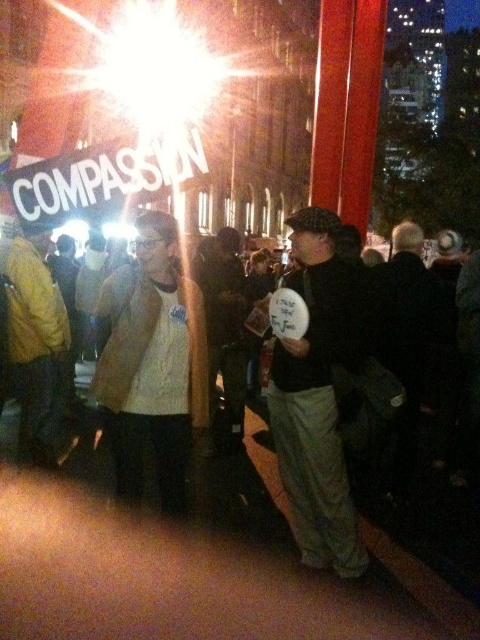
Is matte black shirt at center wider than yellow fabric jacket at left?

Yes.

Does matte black shirt at center appear on the right side of yellow fabric jacket at left?

Indeed, matte black shirt at center is positioned on the right side of yellow fabric jacket at left.

Is point (356, 548) in front of point (34, 381)?

That is True.

Find the location of `matte black shirt at center`. matte black shirt at center is located at coordinates (319, 394).

Which of these two, matte black shirt at center or light brown leather jacket at center, stands shorter?

With less height is light brown leather jacket at center.

Is matte black shirt at center bigger than light brown leather jacket at center?

Indeed, matte black shirt at center has a larger size compared to light brown leather jacket at center.

Where is `matte black shirt at center`? The image size is (480, 640). matte black shirt at center is located at coordinates (319, 394).

At what (x,y) coordinates should I click in order to perform the action: click on matte black shirt at center. Please return your answer as a coordinate pair (x, y). This screenshot has width=480, height=640. Looking at the image, I should click on (319, 394).

From the picture: Does light brown leather jacket at center have a lesser height compared to yellow fabric jacket at left?

In fact, light brown leather jacket at center may be taller than yellow fabric jacket at left.

Is the position of light brown leather jacket at center more distant than that of yellow fabric jacket at left?

No, it is not.

You are a GUI agent. You are given a task and a screenshot of the screen. Output one action in this format:
    pyautogui.click(x=<x>, y=<y>)
    Task: Click on the light brown leather jacket at center
    
    Given the screenshot: What is the action you would take?
    pyautogui.click(x=153, y=364)